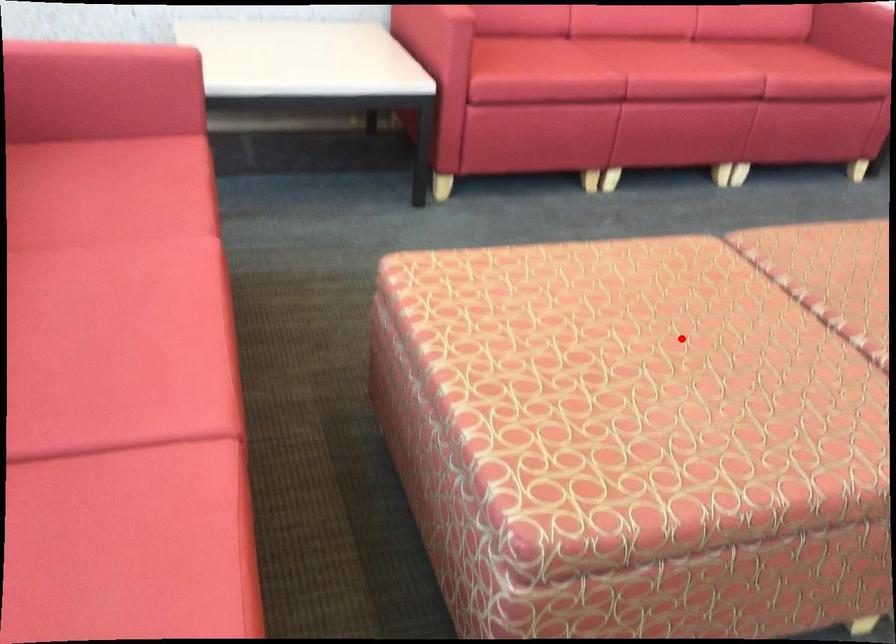
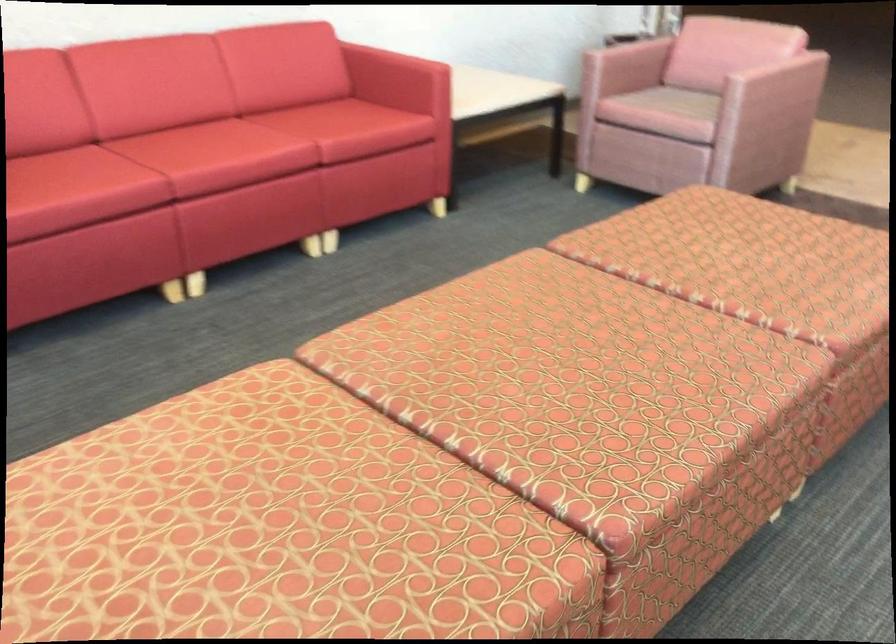
Question: I am providing you with two images of the same scene from different viewpoints. In image1, a red point is highlighted. Considering the same 3D point in image2, which of the following is correct?

Choices:
 (A) It is closer
 (B) It is farther

Answer: (A)